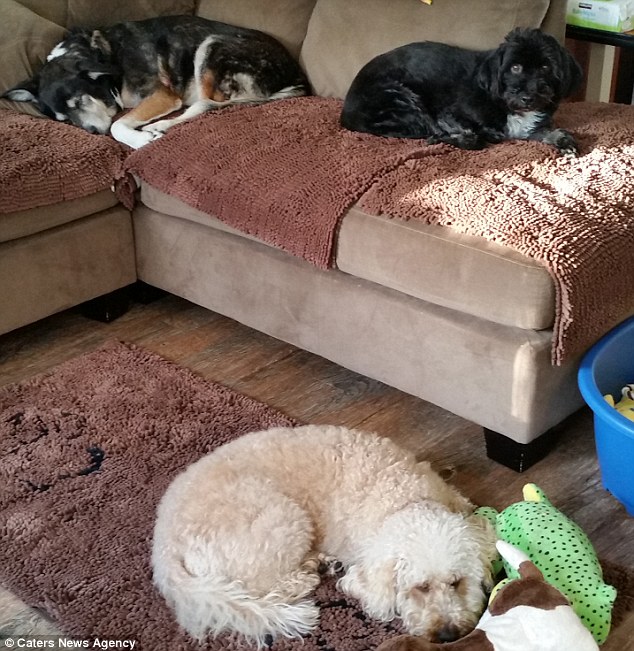
Where is `blue bucket`? blue bucket is located at coordinates (623, 437).